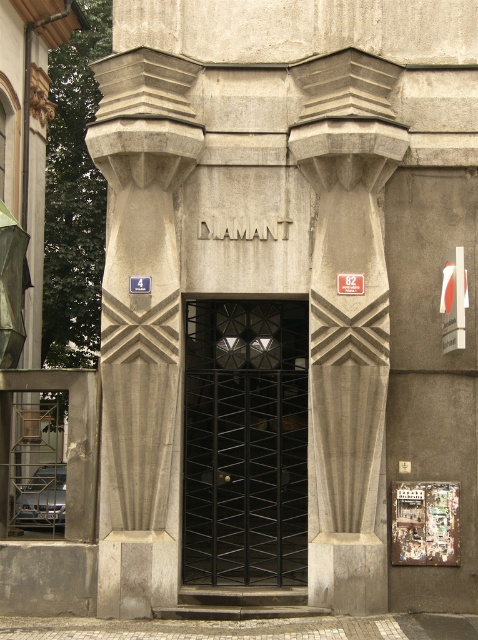
In the scene shown: Who is shorter, gray stone column at center or white plastic sign at right?

white plastic sign at right

Is point (105, 481) farther from camera compared to point (467, 289)?

Yes, it is.

Where is `gray stone column at center`? The image size is (478, 640). gray stone column at center is located at coordinates (141, 321).

Find the location of a particular element. This screenshot has height=640, width=478. gray stone column at center is located at coordinates (141, 321).

Between gray stone column at center and black metal gate at center, which one appears on the right side from the viewer's perspective?

black metal gate at center is more to the right.

Is gray stone column at center closer to camera compared to black metal gate at center?

That is True.

At what (x,y) coordinates should I click in order to perform the action: click on gray stone column at center. Please return your answer as a coordinate pair (x, y). Looking at the image, I should click on (141, 321).

Locate an element on the screen. This screenshot has height=640, width=478. gray stone column at center is located at coordinates (141, 321).

Is point (113, 540) more distant than point (359, 566)?

Yes, it is behind point (359, 566).

Can you confirm if gray stone column at center is thinner than gray concrete column at center?

No, gray stone column at center is not thinner than gray concrete column at center.

Between point (153, 184) and point (340, 317), which one is positioned behind?

The point (153, 184) is behind.

Identify the location of gray stone column at center. (141, 321).